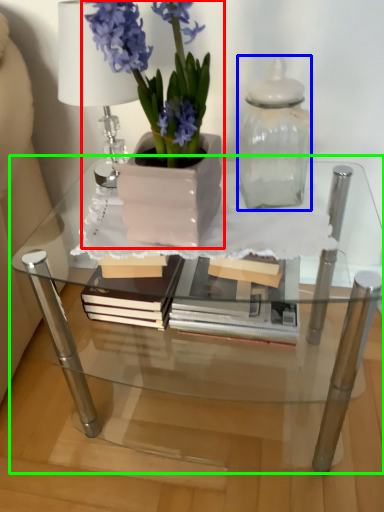
Question: Estimate the real-world distances between objects in this image. Which object is closer to houseplant (highlighted by a red box), glass vase (highlighted by a blue box) or table (highlighted by a green box)?

Choices:
 (A) glass vase
 (B) table

Answer: (A)